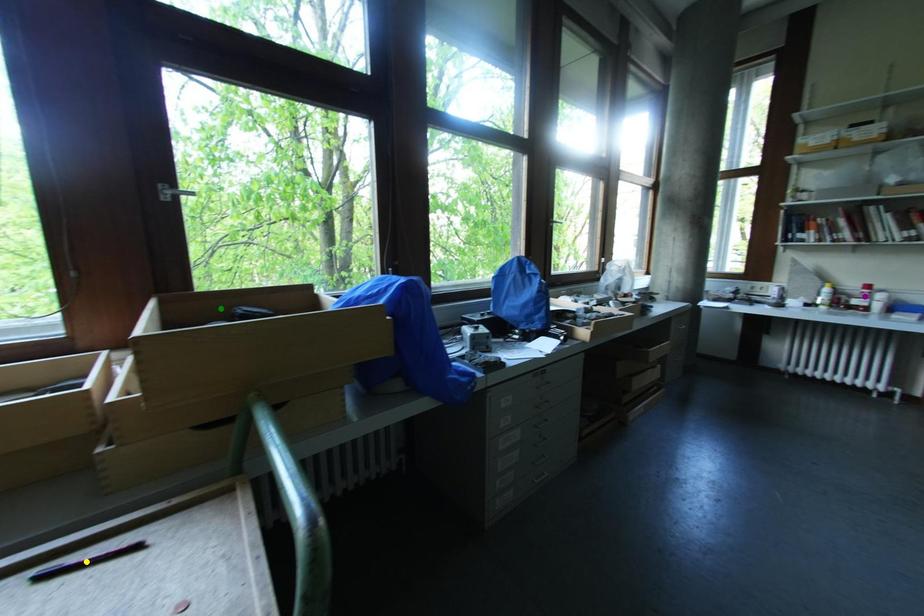
Order these from nearest to farthest:
green point, purple point, yellow point

yellow point → green point → purple point